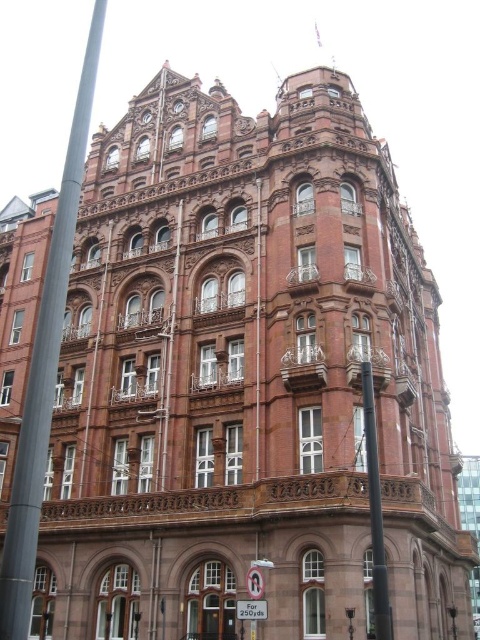
Does metallic pole at left have a lesser width compared to polished metal lamp post at center?

In fact, metallic pole at left might be wider than polished metal lamp post at center.

Is point (50, 344) in front of point (446, 611)?

Yes, it is.

Where is `metallic pole at left`? The height and width of the screenshot is (640, 480). metallic pole at left is located at coordinates (46, 364).

Does point (60, 257) come in front of point (372, 490)?

Yes, it is in front of point (372, 490).

Does metallic pole at left come in front of smooth black pole at center?

Yes.

Find the location of a particular element. The height and width of the screenshot is (640, 480). metallic pole at left is located at coordinates (46, 364).

Is smooth black pole at center below polished metal lamp post at center?

Actually, smooth black pole at center is above polished metal lamp post at center.

Image resolution: width=480 pixels, height=640 pixels. What do you see at coordinates (374, 509) in the screenshot? I see `smooth black pole at center` at bounding box center [374, 509].

Image resolution: width=480 pixels, height=640 pixels. I want to click on smooth black pole at center, so [374, 509].